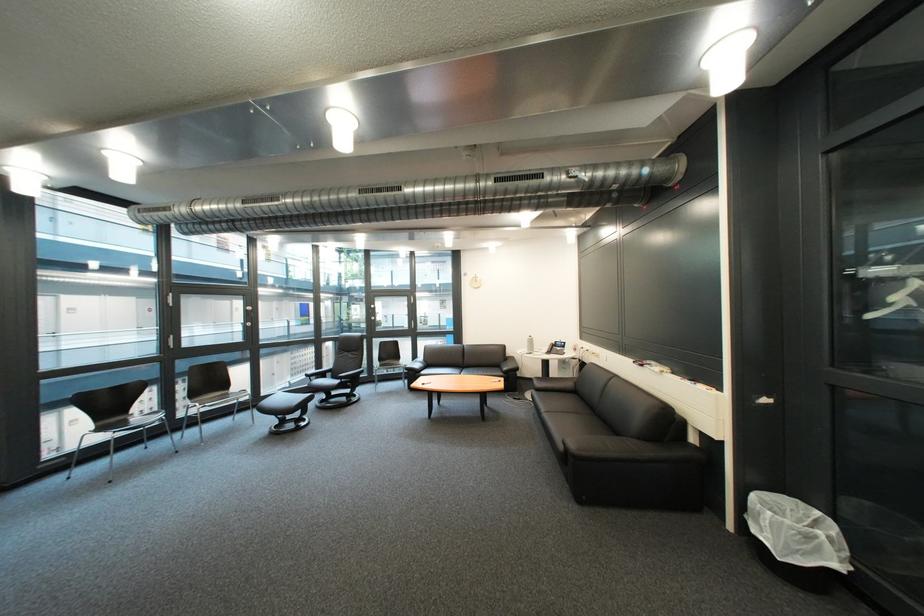
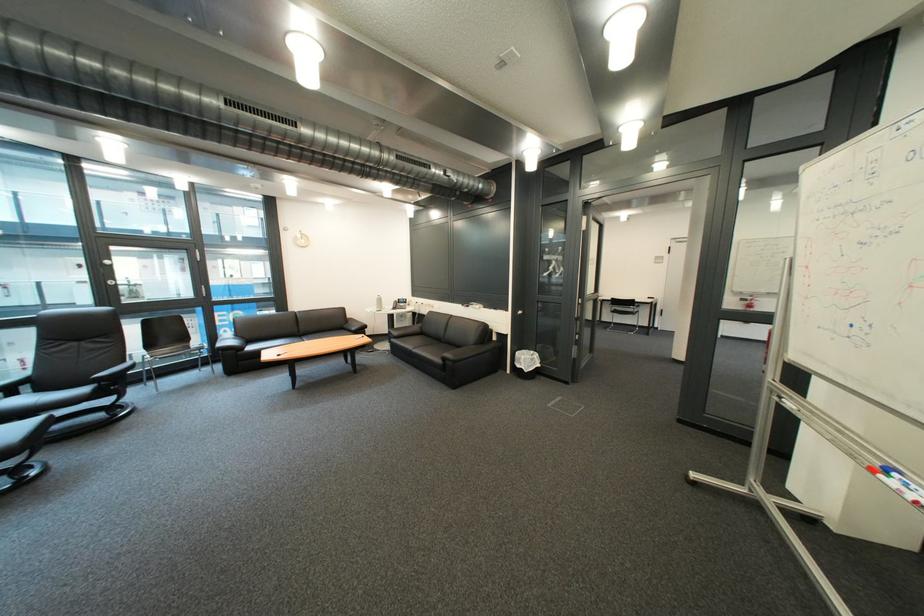
The point at (x=560, y=418) is marked in the first image. Where is the corresponding point in the second image?

(429, 353)